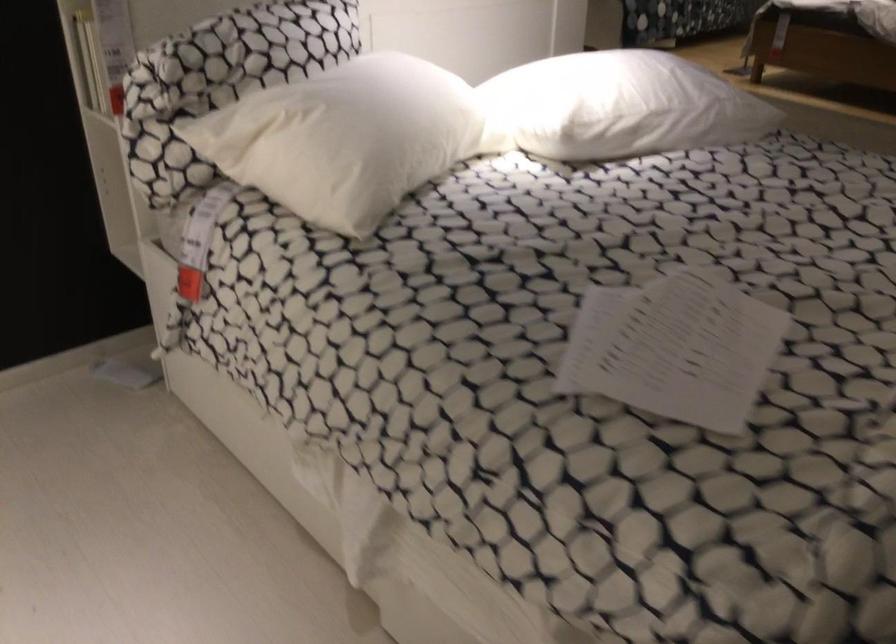
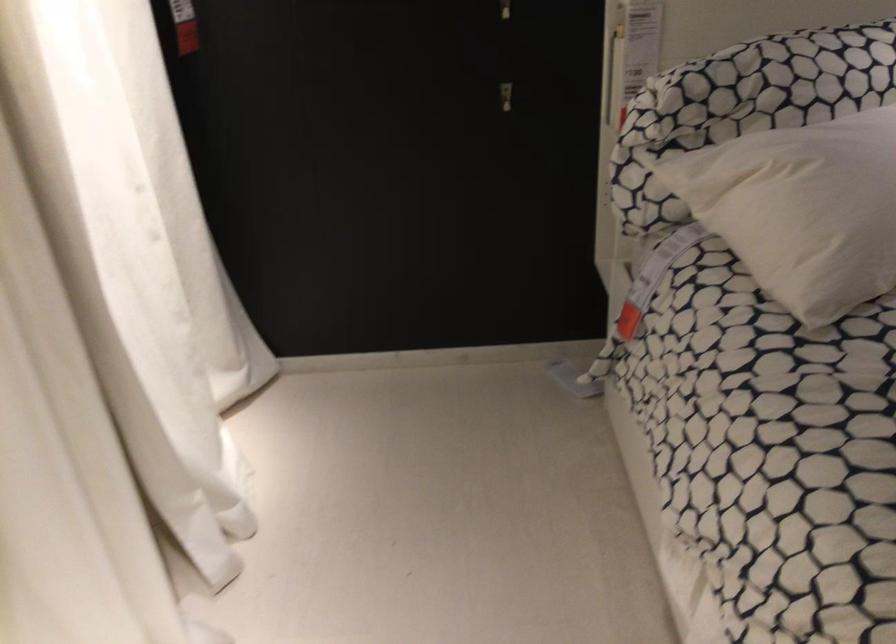
Find the pixel in the second image that matches the point at 194,281 in the first image.

(627, 321)